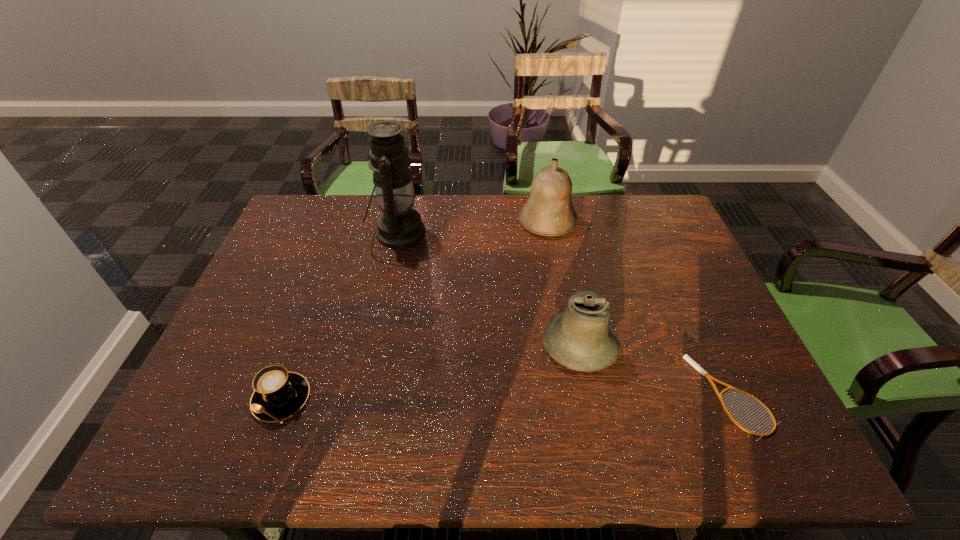
Where is `the third closest object to the second tallest object`? Image resolution: width=960 pixels, height=540 pixels. the third closest object to the second tallest object is located at coordinates (686, 357).

I want to click on free space that satisfies the following two spatial constraints: 1. on the front side of the shortest object; 2. on the left side of the second object from left to right, so click(x=363, y=396).